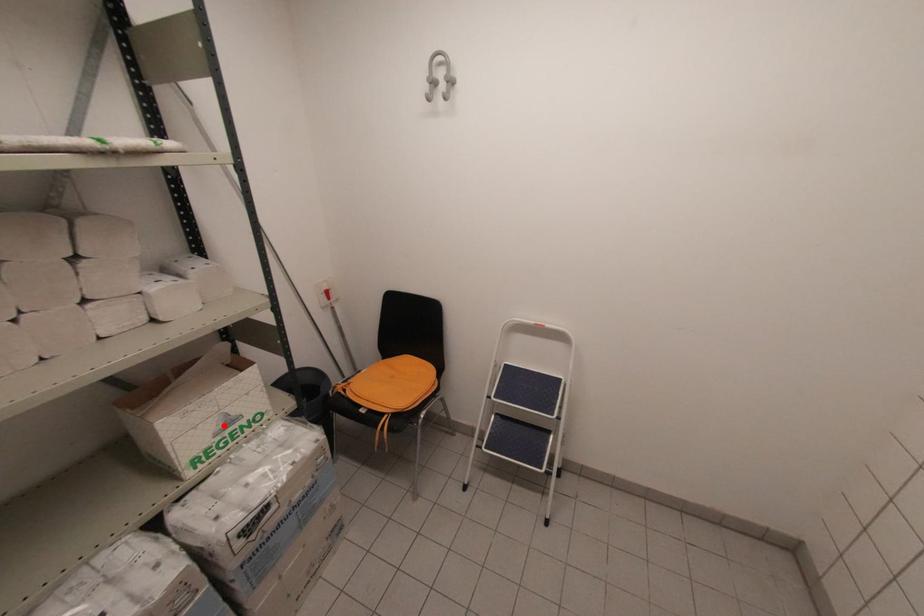
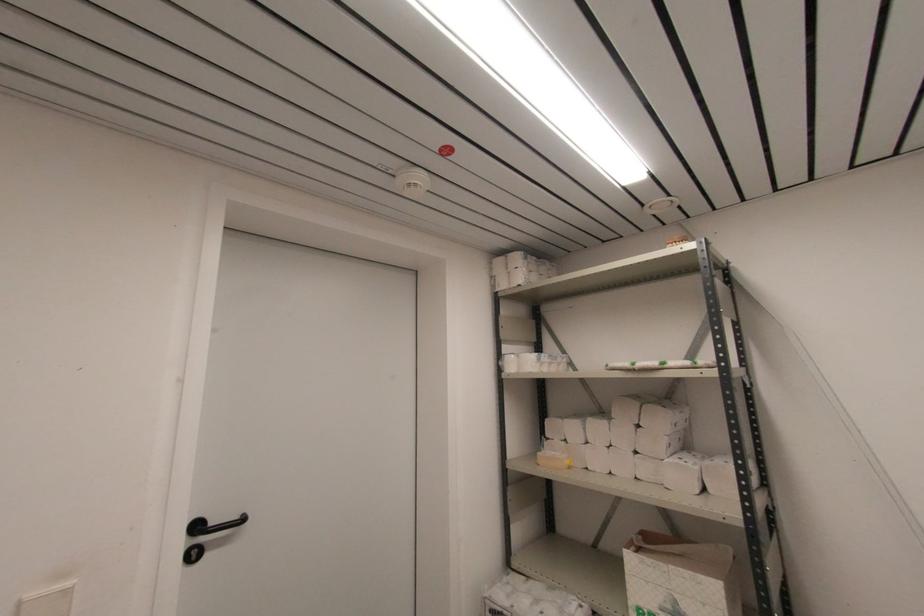
Find the pixel in the second image that matches the highlighted location in the first image.

(671, 609)